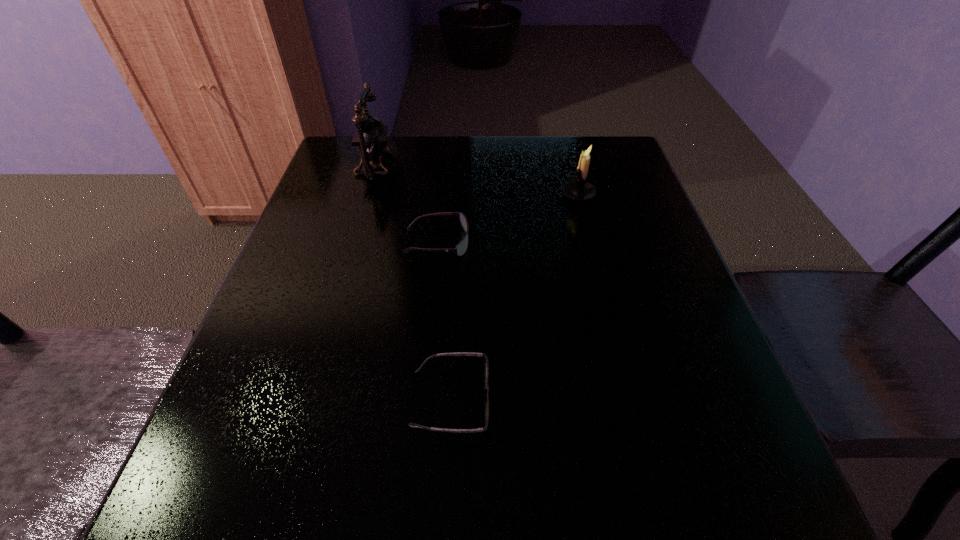
You are a GUI agent. You are given a task and a screenshot of the screen. Output one action in this format:
    pyautogui.click(x=<x>, y=<y>)
    Task: Click on the vacant space at the near left corner
    This screenshot has height=540, width=960.
    Given the screenshot: What is the action you would take?
    point(170,526)

Locate an element on the screen. Image resolution: width=960 pixels, height=540 pixels. vacant space at the far right corner of the desktop is located at coordinates click(x=616, y=147).

The height and width of the screenshot is (540, 960). Find the location of `empty space that is in between the second shortest object and the candle holder`. empty space that is in between the second shortest object and the candle holder is located at coordinates (508, 218).

Locate an element on the screen. vacant area that lies between the telephone and the candle holder is located at coordinates (478, 180).

Find the location of a particular element. This screenshot has height=540, width=960. unoccupied position between the second tallest object and the third farthest object is located at coordinates (508, 218).

Identify the location of unoccupied position between the rightmost object and the telephone. The width and height of the screenshot is (960, 540). (478, 180).

Identify the location of free space between the leftmost object and the second nearest object. The width and height of the screenshot is (960, 540). (407, 204).

Where is `free space between the second shortest object and the shortest object`? free space between the second shortest object and the shortest object is located at coordinates (444, 321).

Image resolution: width=960 pixels, height=540 pixels. In order to click on free point between the nearest object and the taller sunglasses in this screenshot , I will do `click(444, 321)`.

Locate an element on the screen. The width and height of the screenshot is (960, 540). empty location between the shortest object and the telephone is located at coordinates (414, 282).